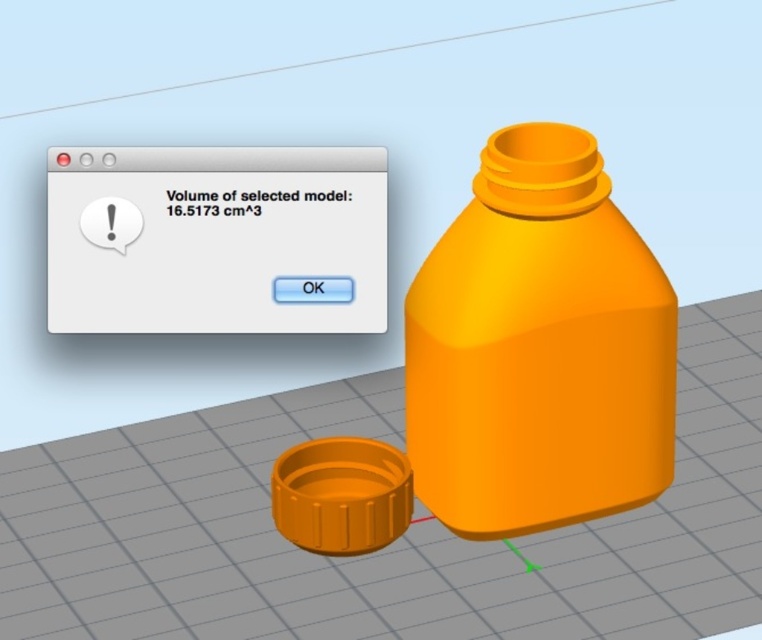
Question: Can you confirm if orange matte plastic bottle at center is positioned above matte orange plastic bottle at center?

Choices:
 (A) yes
 (B) no

Answer: (B)

Question: Which point appears closest to the camera in this image?

Choices:
 (A) (114, 314)
 (B) (527, 371)

Answer: (B)

Question: Which of the following is the farthest from the observer?

Choices:
 (A) orange matte plastic bottle at center
 (B) matte orange plastic bottle at center

Answer: (B)

Question: Is orange matte plastic bottle at center above matte orange plastic bottle at center?

Choices:
 (A) yes
 (B) no

Answer: (B)

Question: Which object appears farthest from the camera in this image?

Choices:
 (A) orange matte plastic bottle at center
 (B) matte orange plastic bottle at center

Answer: (B)

Question: Is orange matte plastic bottle at center thinner than matte orange plastic bottle at center?

Choices:
 (A) no
 (B) yes

Answer: (B)